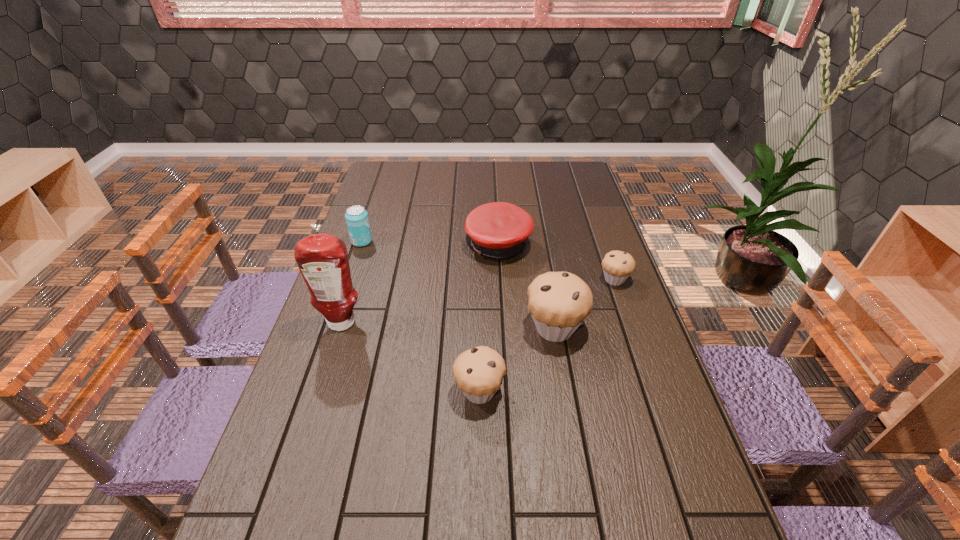
This screenshot has width=960, height=540. I want to click on free space between the cap and the shortest muffin, so click(557, 262).

Where is `empty space that is in between the beer can and the cap`? Image resolution: width=960 pixels, height=540 pixels. empty space that is in between the beer can and the cap is located at coordinates [430, 244].

You are a GUI agent. You are given a task and a screenshot of the screen. Output one action in this format:
    pyautogui.click(x=<x>, y=<y>)
    Task: Click on the third closest object to the condiment
    Image resolution: width=960 pixels, height=540 pixels.
    Given the screenshot: What is the action you would take?
    pyautogui.click(x=499, y=230)

Locate which object is the fourth closest to the fourth nearest object. Please provide its 2D coordinates. Your answer should be formatted as a tuple, i.e. [(x, y)], where the tuple contains the x and y coordinates of a point satisfying the conditions above.

[(322, 259)]

Point out which muffin is positioned as the third nearest to the beer can. Please provide its 2D coordinates. Your answer should be formatted as a tuple, i.e. [(x, y)], where the tuple contains the x and y coordinates of a point satisfying the conditions above.

[(617, 265)]

This screenshot has height=540, width=960. Find the location of `muffin that is the second closest one to the farthest muffin`. muffin that is the second closest one to the farthest muffin is located at coordinates point(479,371).

Find the location of a particular element. The height and width of the screenshot is (540, 960). free space in the image that satisfies the following two spatial constraints: 1. on the front-facing side of the cap; 2. on the front side of the tallest object is located at coordinates (503, 323).

Identify the location of vacant area that satisfies the following two spatial constraints: 1. on the back side of the shortest muffin; 2. on the front-facing side of the cap. (603, 246).

Where is `free location that satisfies the following two spatial constraints: 1. on the front-facing side of the cap; 2. on the back side of the fifth shortest object`? The width and height of the screenshot is (960, 540). free location that satisfies the following two spatial constraints: 1. on the front-facing side of the cap; 2. on the back side of the fifth shortest object is located at coordinates (503, 328).

Identify the location of free space in the image that satisfies the following two spatial constraints: 1. on the front side of the condiment; 2. on the left side of the beer can. (334, 323).